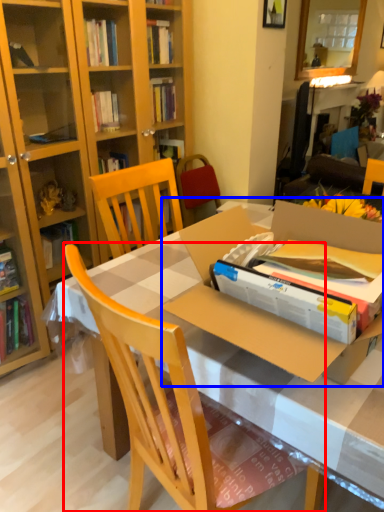
Question: Which object is further to the camera taking this photo, chair (highlighted by a red box) or cardboard box (highlighted by a blue box)?

Choices:
 (A) chair
 (B) cardboard box

Answer: (B)